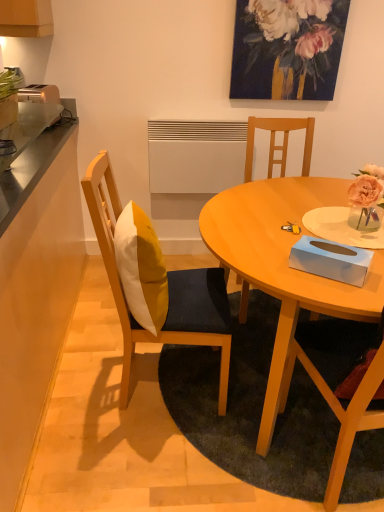
The image size is (384, 512). What are the coordinates of `vacant area on top of dark gray carpet at lower center (from a real-world perspective)` in the screenshot? It's located at (256, 408).